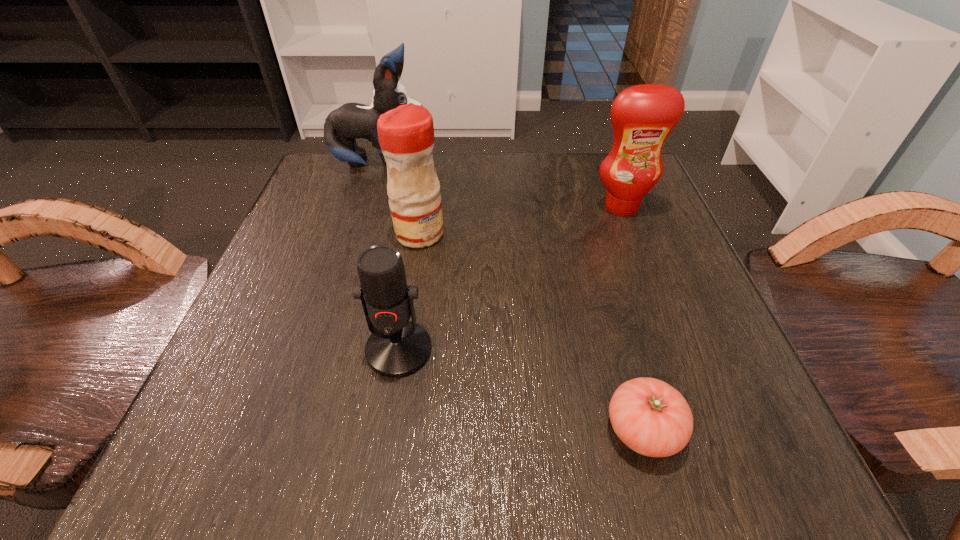
Find the location of a particular element. Image resolution: width=960 pixels, height=540 pixels. object located in the far left corner section of the desktop is located at coordinates (351, 121).

At what (x,y) coordinates should I click in order to perform the action: click on object at the far right corner. Please return your answer as a coordinate pair (x, y). Looking at the image, I should click on (643, 116).

Locate an element on the screen. Image resolution: width=960 pixels, height=540 pixels. object at the near right corner is located at coordinates pyautogui.click(x=652, y=418).

Locate an element on the screen. This screenshot has width=960, height=540. vacant space at the far edge of the desktop is located at coordinates (497, 193).

Locate an element on the screen. The width and height of the screenshot is (960, 540). vacant space at the left edge of the desktop is located at coordinates (277, 361).

At what (x,y) coordinates should I click in order to perform the action: click on vacant point at the right edge. Please return your answer as a coordinate pair (x, y). The height and width of the screenshot is (540, 960). Looking at the image, I should click on (612, 265).

In the image, there is a desktop. Find the location of `blank space at the far left corner`. blank space at the far left corner is located at coordinates (301, 200).

In the image, there is a desktop. Identify the location of vacant space at the far right corner. (582, 172).

Locate an element on the screen. Image resolution: width=960 pixels, height=540 pixels. free space at the near right corner is located at coordinates (709, 424).

This screenshot has width=960, height=540. What are the coordinates of `empty space between the farther condiment and the tomato` in the screenshot? It's located at (633, 318).